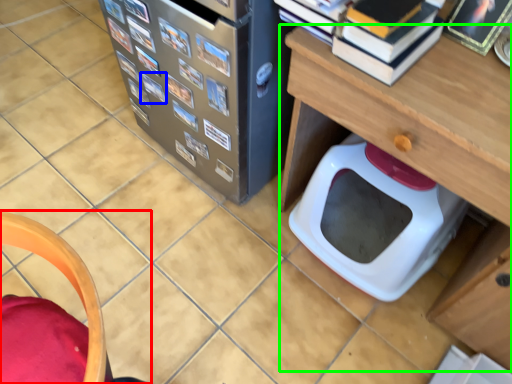
Question: Which object is the closest to the furniture (highlighted by a red box)? Choose among these: book (highlighted by a blue box) or table (highlighted by a green box).

Choices:
 (A) book
 (B) table

Answer: (B)